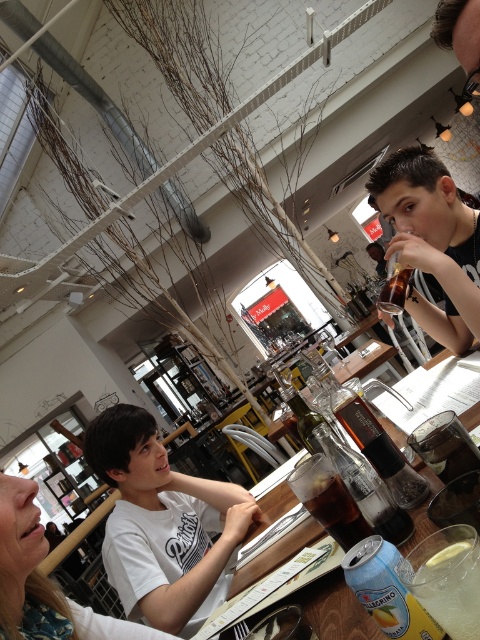
Who is higher up, clear plastic cup at center or translucent glass bottle at upper right?

translucent glass bottle at upper right is higher up.

Can you confirm if clear plastic cup at center is positioned below translucent glass bottle at upper right?

Correct, clear plastic cup at center is located below translucent glass bottle at upper right.

Is point (457, 588) farther from viewer compared to point (405, 289)?

No.

Locate an element on the screen. clear plastic cup at center is located at coordinates (448, 579).

Does clear glass table at center have a larger size compared to clear plastic cup at center?

Correct, clear glass table at center is larger in size than clear plastic cup at center.

Does clear glass table at center have a greater width compared to clear plastic cup at center?

Yes.

Who is more forward, (283, 509) or (432, 573)?

Point (432, 573) is in front.

Image resolution: width=480 pixels, height=640 pixels. I want to click on clear glass table at center, so tap(338, 612).

Which is in front, point (416, 163) or point (452, 604)?

Point (452, 604) is more forward.

Is point (460, 220) farther from viewer compared to point (458, 625)?

Yes, point (460, 220) is farther from viewer.

The width and height of the screenshot is (480, 640). Identify the location of black matte shirt at upper right. (432, 241).